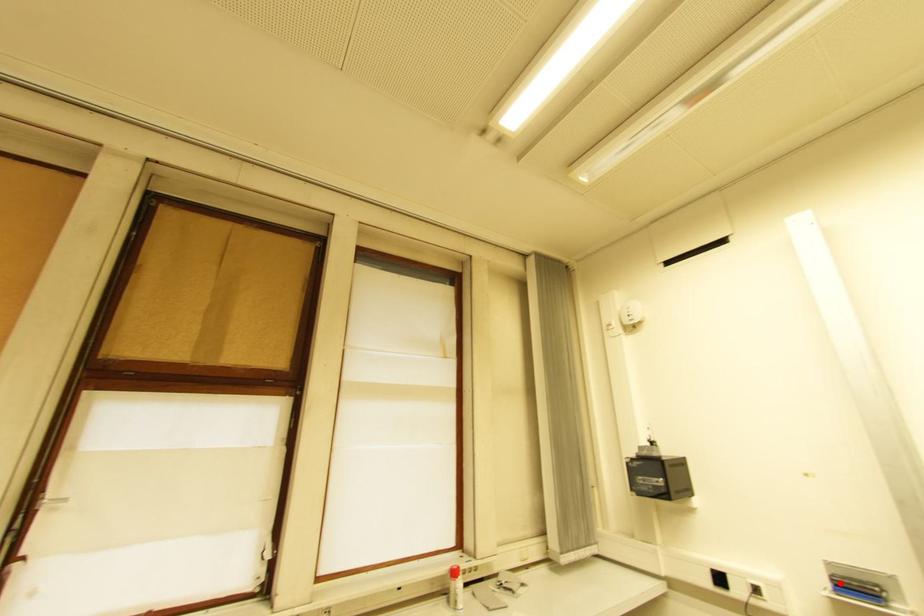
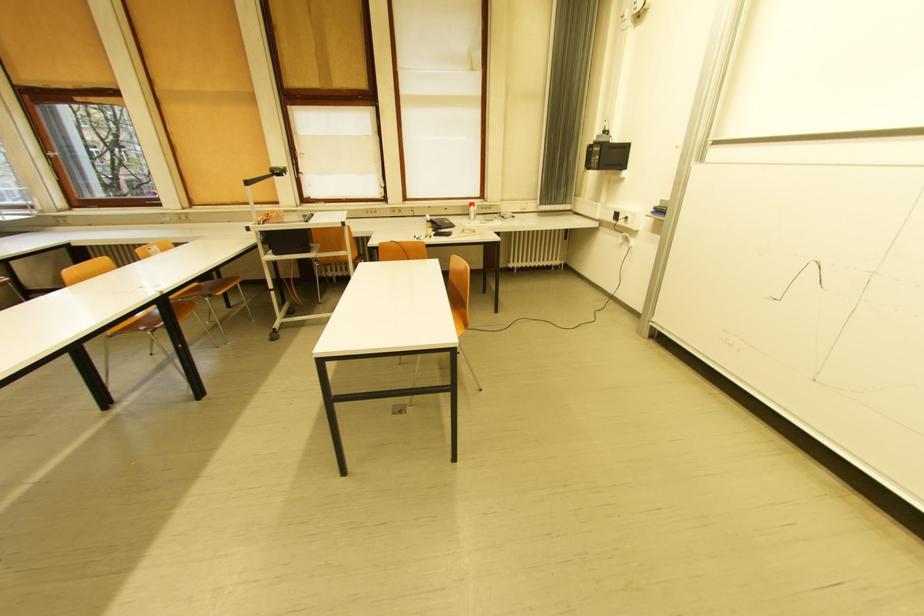
Question: I am providing you with two images of the same scene from different viewpoints. In image1, a red point is highlighted. Considering the same 3D point in image2, which of the following is correct?

Choices:
 (A) It is closer
 (B) It is farther

Answer: (B)